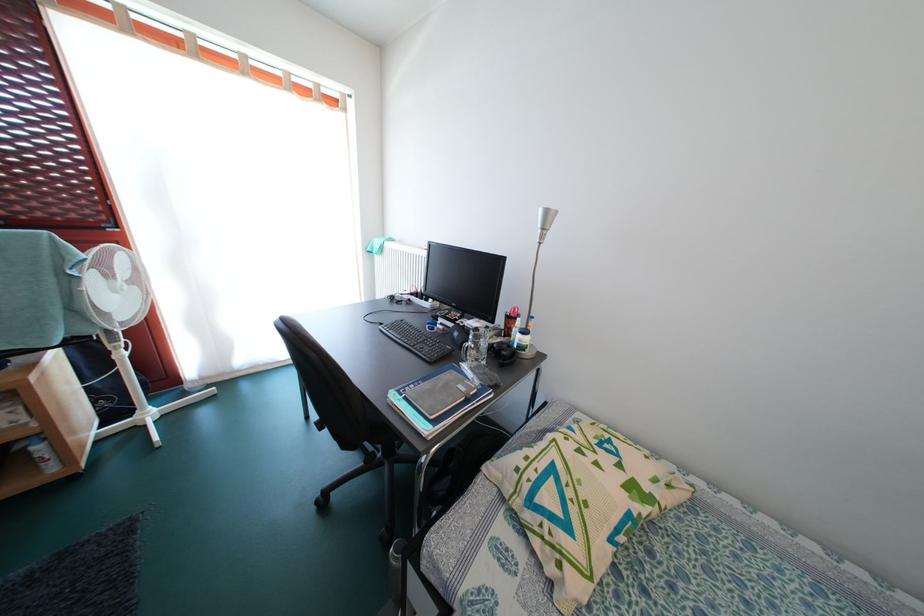
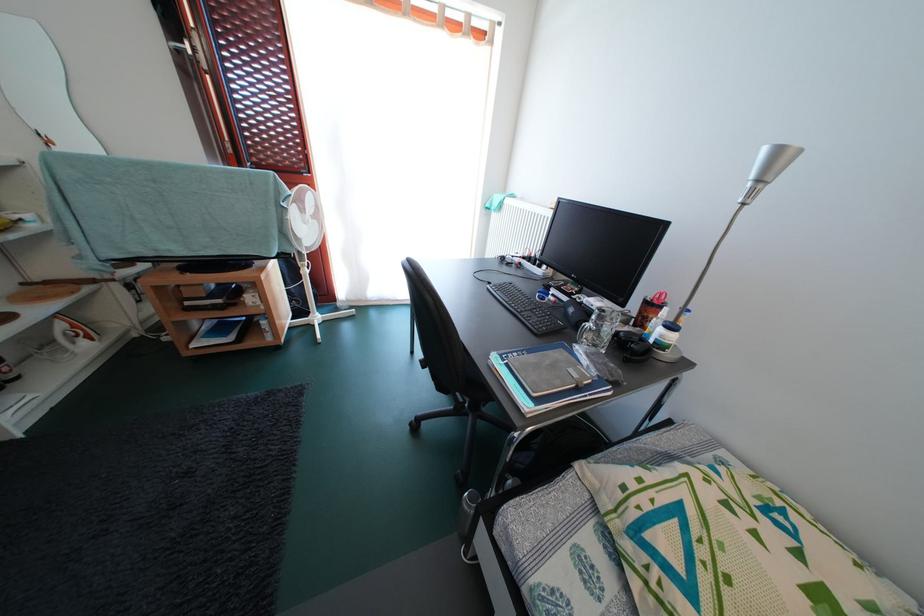
Locate, in the second image, the point that corresponds to the point at 483,365 in the first image.

(602, 351)